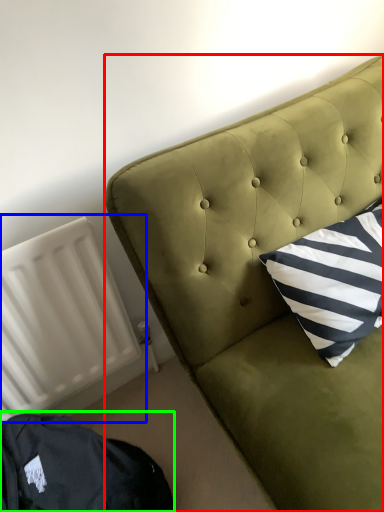
Question: Which object is positioned closest to furniture (highlighted by a red box)? Select from radiator (highlighted by a blue box) and bean bag chair (highlighted by a green box).

Choices:
 (A) radiator
 (B) bean bag chair

Answer: (A)